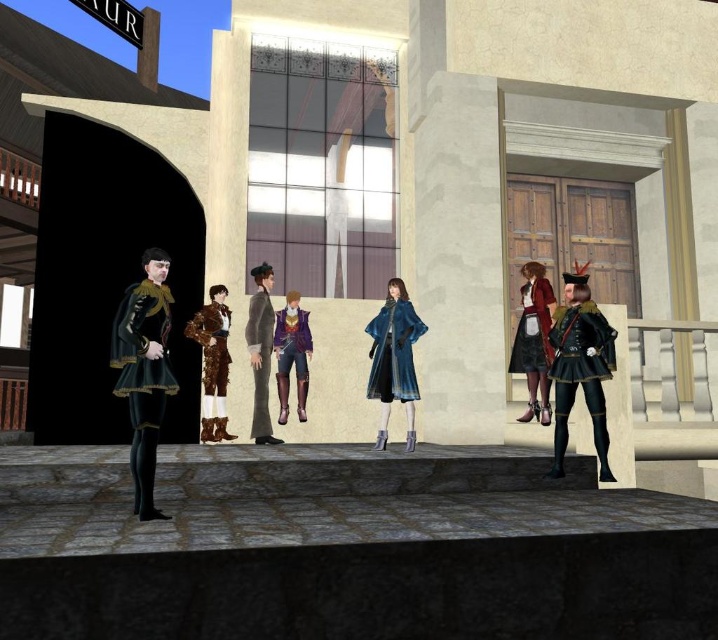
Who is higher up, velvet black cape at left or matte red skirt at right?

matte red skirt at right is higher up.

Is velvet black cape at left wider than matte red skirt at right?

Yes.

This screenshot has height=640, width=718. In order to click on velvet black cape at left in this screenshot , I will do `click(144, 378)`.

This screenshot has width=718, height=640. I want to click on velvet black cape at left, so click(x=144, y=378).

How far apart are velvet black cape at left and leather jacket at center?

3.49 meters

Can you confirm if velvet black cape at left is smaller than leather jacket at center?

Indeed, velvet black cape at left has a smaller size compared to leather jacket at center.

Does point (146, 284) come behind point (225, 323)?

No, it is in front of (225, 323).

Find the location of a particular element. velvet black cape at left is located at coordinates (144, 378).

Is shiny gold armor at right taller than gray fabric suit at center?

→ In fact, shiny gold armor at right may be shorter than gray fabric suit at center.

Is point (572, 317) more distant than point (269, 312)?

No, (572, 317) is in front of (269, 312).

You are a GUI agent. You are given a task and a screenshot of the screen. Output one action in this format:
    pyautogui.click(x=<x>, y=<y>)
    Task: Click on the shiny gold armor at right
    This screenshot has height=640, width=718.
    Given the screenshot: What is the action you would take?
    pyautogui.click(x=582, y=371)